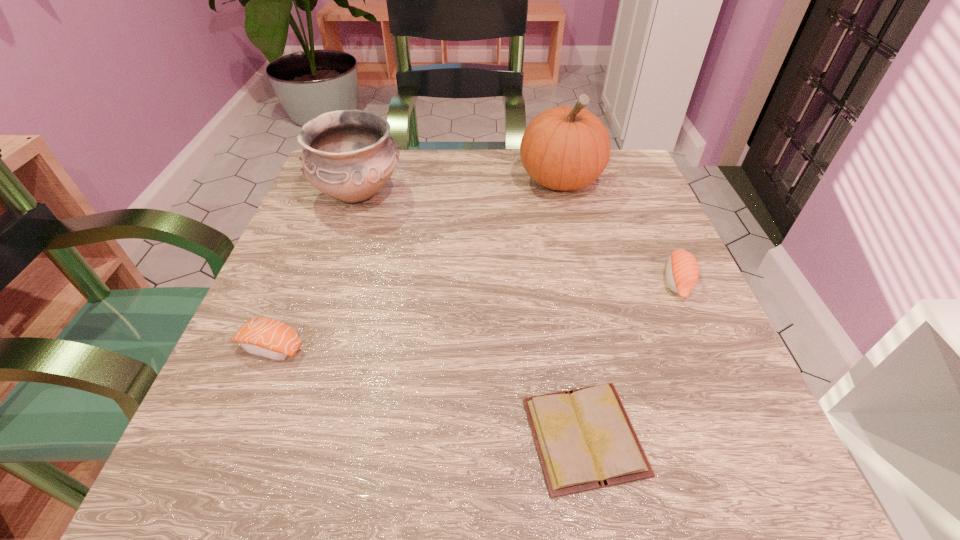
The height and width of the screenshot is (540, 960). I want to click on vacant area that lies between the right sushi and the pumpkin, so click(x=619, y=231).

You are a GUI agent. You are given a task and a screenshot of the screen. Output one action in this format:
    pyautogui.click(x=<x>, y=<y>)
    Task: Click on the free space between the fourth shortest object and the pumpkin
    This screenshot has width=960, height=540.
    Given the screenshot: What is the action you would take?
    [x=459, y=187]

Find the location of `free spot between the tallest object and the nearer sushi`. free spot between the tallest object and the nearer sushi is located at coordinates (416, 264).

Locate an element on the screen. The width and height of the screenshot is (960, 540). free spot between the diary and the pottery is located at coordinates (471, 315).

You are a GUI agent. You are given a task and a screenshot of the screen. Output one action in this format:
    pyautogui.click(x=<x>, y=<y>)
    Task: Click on the vacant space that is in between the tallest object and the fourth shortest object
    Image resolution: width=960 pixels, height=540 pixels.
    Given the screenshot: What is the action you would take?
    pyautogui.click(x=459, y=187)

The height and width of the screenshot is (540, 960). I want to click on vacant region between the tallest object and the pottery, so click(459, 187).

This screenshot has width=960, height=540. I want to click on empty space that is in between the tallest object and the farther sushi, so click(x=619, y=231).

Identify the location of vacant area that lies between the tallest object and the nearest object. (572, 308).

At what (x,y) coordinates should I click in order to perform the action: click on free space between the nearest object and the right sushi. Please return your answer as a coordinate pair (x, y). The width and height of the screenshot is (960, 540). Looking at the image, I should click on (631, 359).

Locate an element on the screen. This screenshot has height=540, width=960. empty space between the tallest object and the third shortest object is located at coordinates point(619,231).